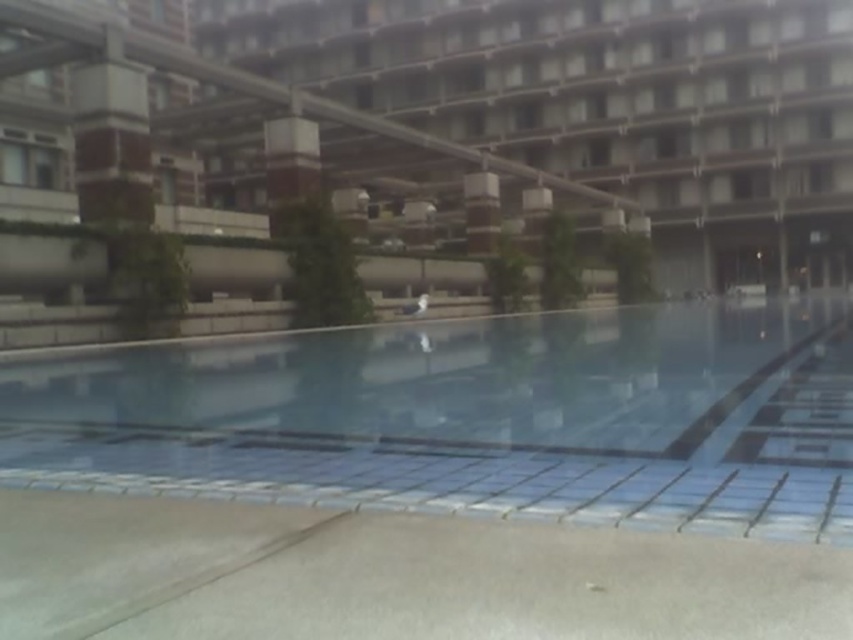
You are planning to install a new fence around the clear glass pool at center and the concrete building at center. Given their sizes, which one requires a longer fence to enclose?

The concrete building at center requires a longer fence because it occupies more space than the clear glass pool at center according to the description.

You are standing at the point labeled as point (471, 419) in the image. What object are you directly facing?

You are directly facing the clear glass pool at center.

You are standing at the edge of the clear glass pool at center and want to look at the concrete building at center. In which direction should you turn your head to see it?

You should turn your head to the left to see the concrete building at center because the clear glass pool at center is to the right of the concrete building at center.